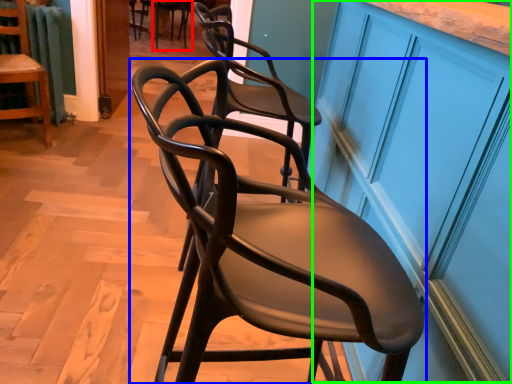
Question: Which object is the farthest from chair (highlighted by a red box)? Choose among these: chair (highlighted by a blue box) or cabinetry (highlighted by a green box).

Choices:
 (A) chair
 (B) cabinetry

Answer: (A)